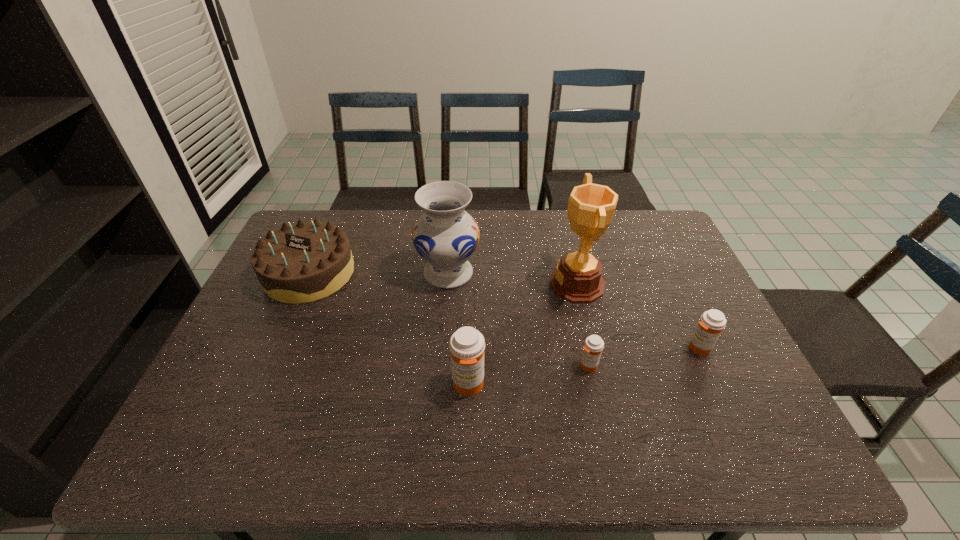
Find the location of a particular element. This screenshot has width=960, height=540. the leftmost medicine is located at coordinates (467, 345).

Find the location of a particular element. This screenshot has height=540, width=960. the tallest medicine is located at coordinates [467, 345].

Locate an element on the screen. The height and width of the screenshot is (540, 960). the shortest object is located at coordinates (593, 346).

I want to click on the shortest medicine, so click(x=593, y=346).

Locate an element on the screen. The width and height of the screenshot is (960, 540). the rightmost object is located at coordinates (712, 322).

Where is `the third nearest object`? The width and height of the screenshot is (960, 540). the third nearest object is located at coordinates (712, 322).

The height and width of the screenshot is (540, 960). Find the location of `vase`. vase is located at coordinates (445, 236).

I want to click on award, so click(577, 279).

In order to click on the leftmost object in this screenshot , I will do `click(300, 263)`.

Locate an element on the screen. The image size is (960, 540). vacant region located 0.170m on the right of the leftmost medicine is located at coordinates click(x=556, y=385).